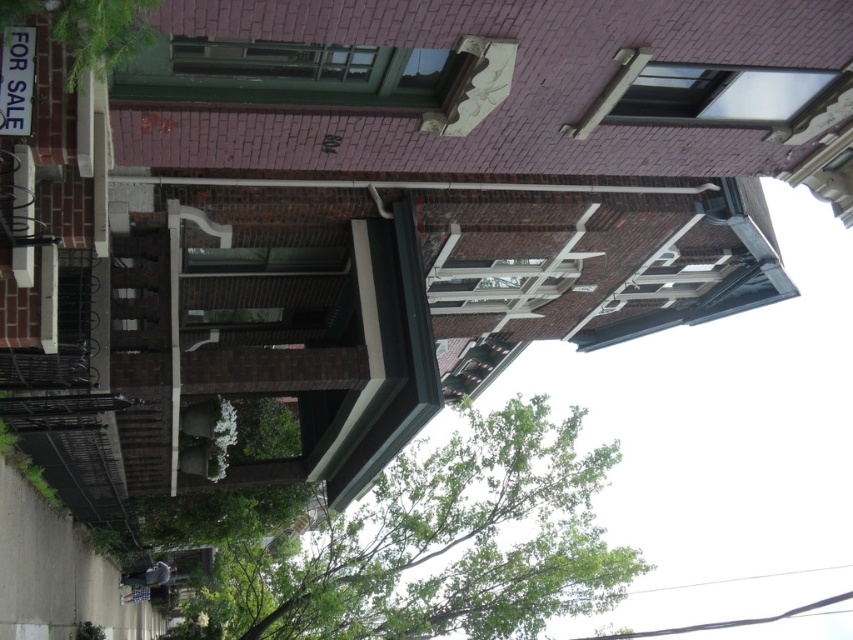
Is green leafy tree at lower center positioned behind green leafy tree at upper left?

Yes, it is.

Who is more forward, (310, 545) or (74, 48)?

Point (74, 48) is more forward.

Image resolution: width=853 pixels, height=640 pixels. Describe the element at coordinates (436, 545) in the screenshot. I see `green leafy tree at lower center` at that location.

Identify the location of green leafy tree at lower center. (436, 545).